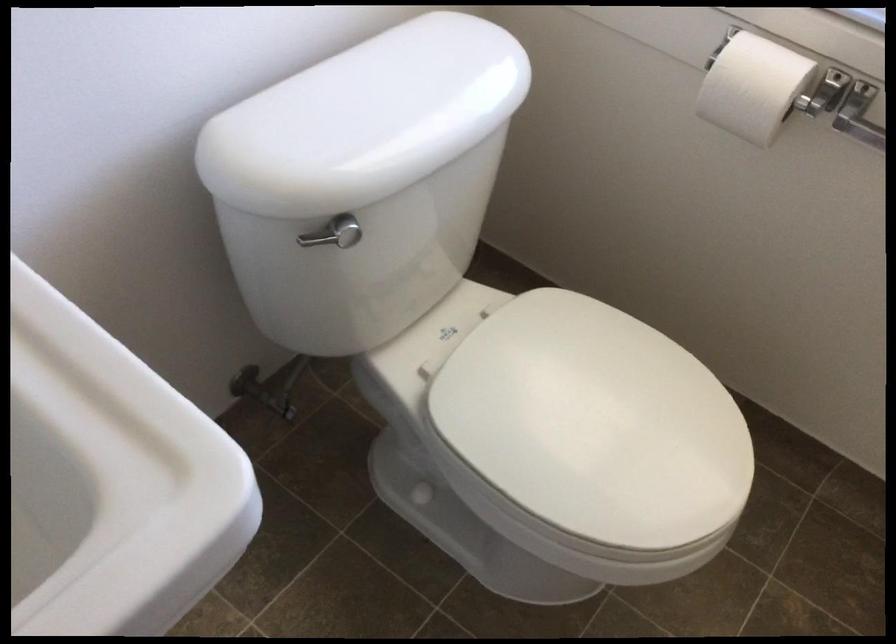
The height and width of the screenshot is (644, 896). Identify the location of metal valve handle. click(x=285, y=408).